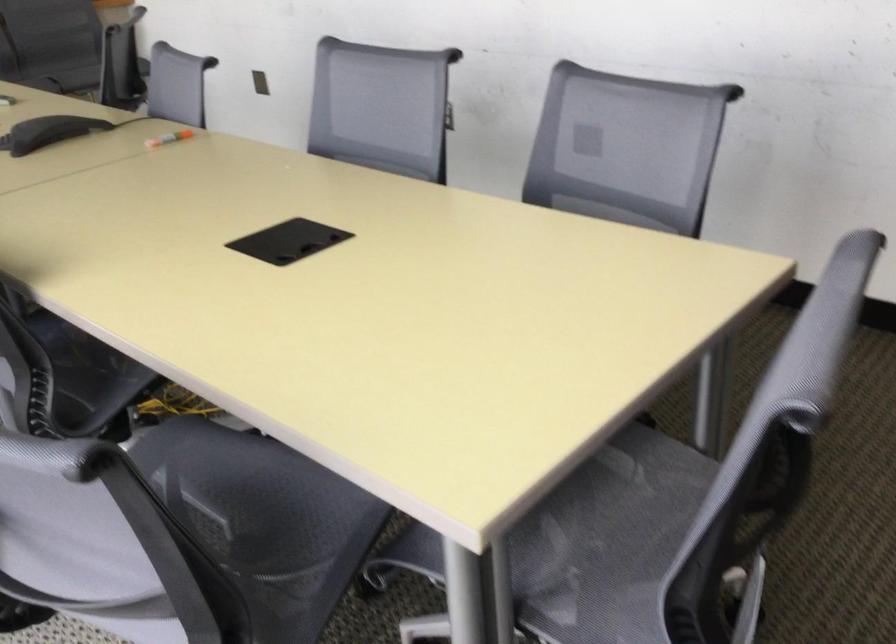
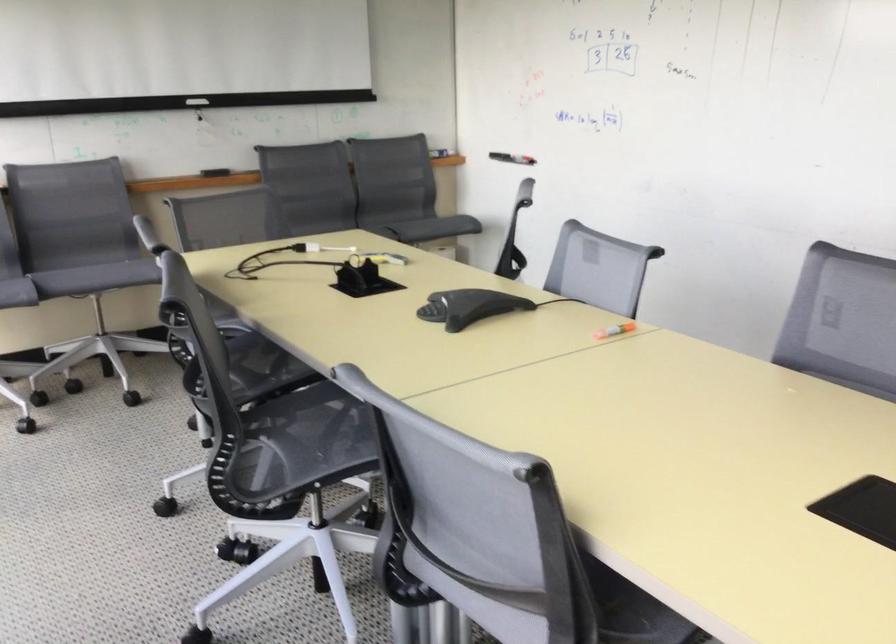
Question: The camera is either moving clockwise (left) or counter-clockwise (right) around the object. The first image is from the beginning of the video and the second image is from the end. Is the camera moving left or right when shooting the video?

Choices:
 (A) Left
 (B) Right

Answer: (B)